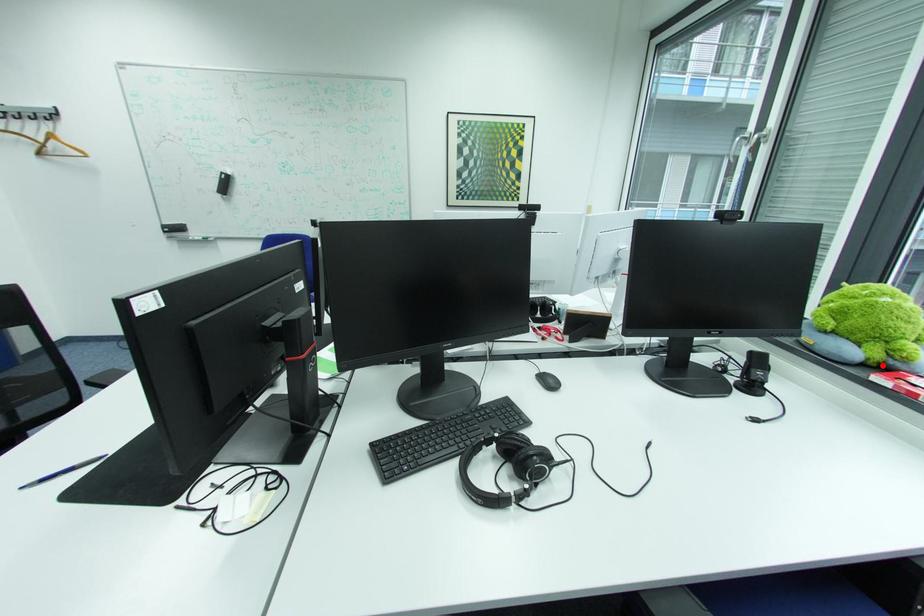
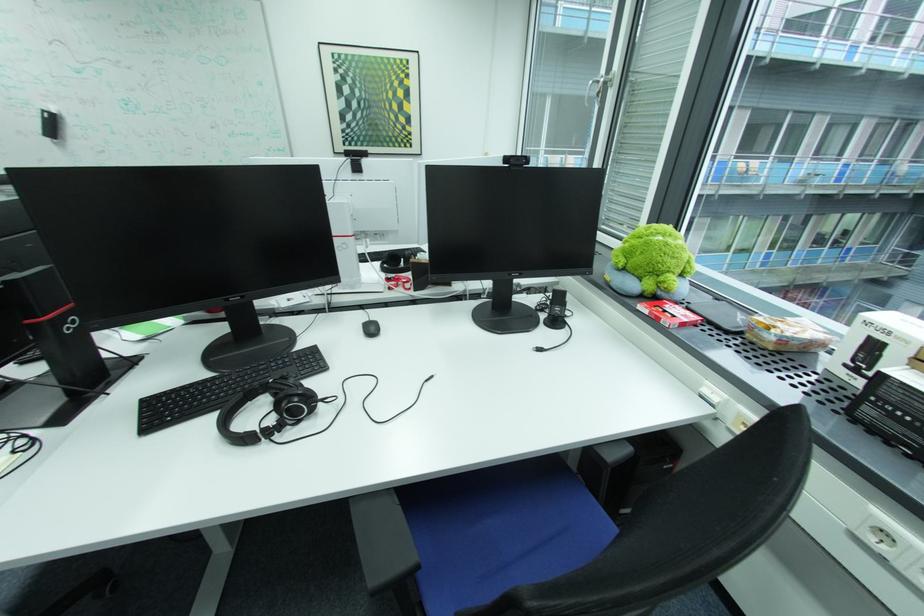
Question: I am providing you with two images of the same scene from different viewpoints. A red point is marked on the first image. Is the red point's position out of view in image 2?

Choices:
 (A) Yes
 (B) No

Answer: (B)